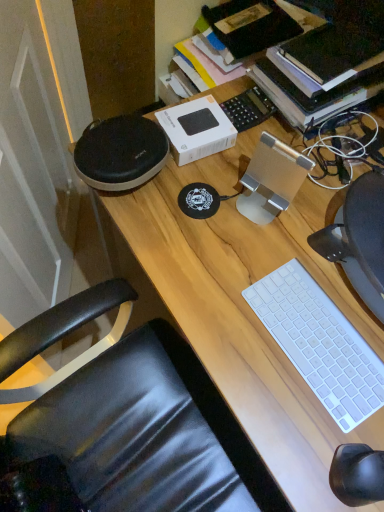
At what (x,y) coordinates should I click in order to perform the action: click on vacant space situated above white plastic keyboard at lower right (from a real-world perspective). Please return your answer as a coordinate pair (x, y). Looking at the image, I should click on (321, 340).